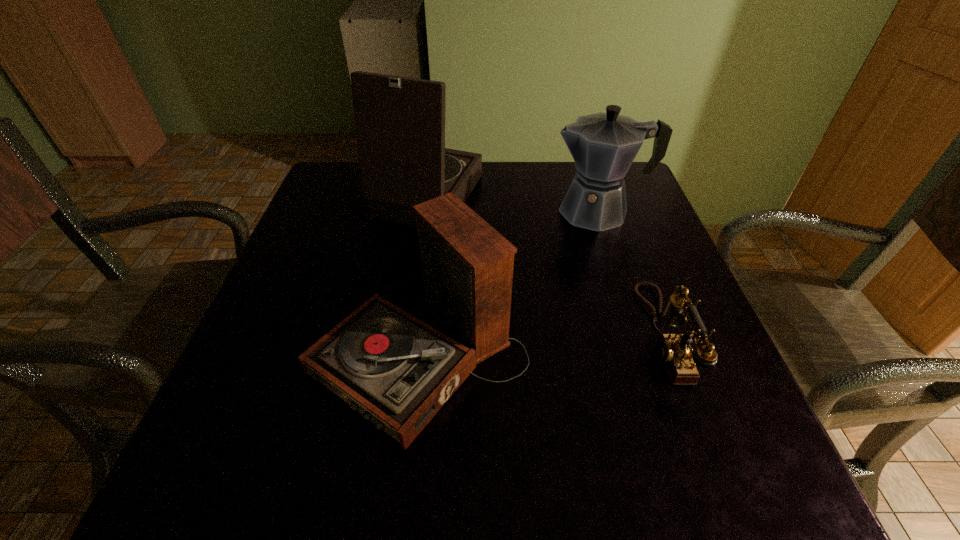
Where is `vacant space situated on the back of the shorter phonograph record`? The width and height of the screenshot is (960, 540). vacant space situated on the back of the shorter phonograph record is located at coordinates (435, 234).

Where is `free location located on the front-facing side of the telephone`? free location located on the front-facing side of the telephone is located at coordinates (483, 335).

Where is `vacant space located on the front-facing side of the telephone`? This screenshot has height=540, width=960. vacant space located on the front-facing side of the telephone is located at coordinates (578, 335).

Where is `free location located on the front-facing side of the telephone`? free location located on the front-facing side of the telephone is located at coordinates (589, 335).

In order to click on phonograph record that is at the far edge in this screenshot , I will do `click(400, 122)`.

This screenshot has height=540, width=960. I want to click on coffeepot located at the far edge, so click(x=603, y=145).

What are the coordinates of `object present at the near edge` in the screenshot? It's located at (397, 371).

I want to click on coffeepot that is at the right edge, so click(x=603, y=145).

The width and height of the screenshot is (960, 540). I want to click on telephone that is at the right edge, so click(x=674, y=351).

I want to click on object that is at the far left corner, so click(400, 122).